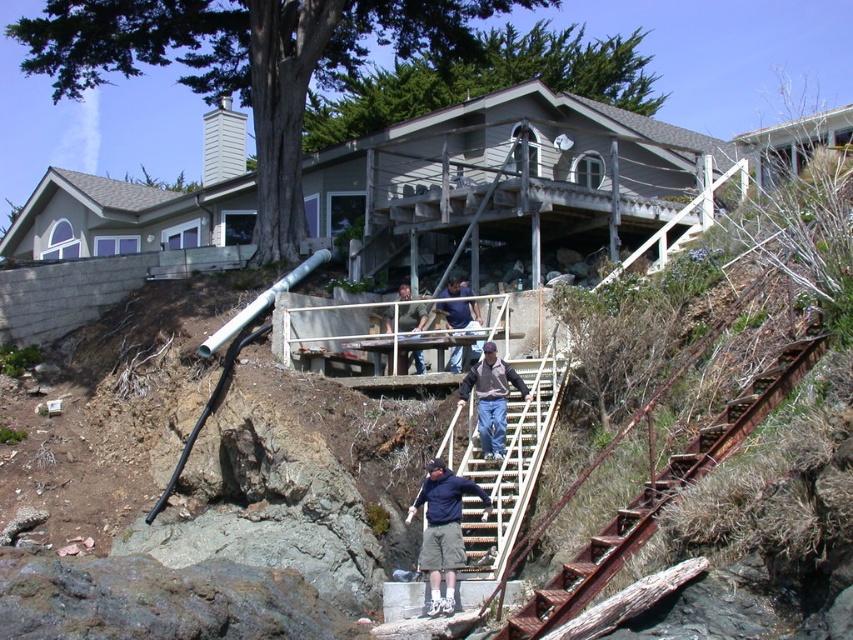
Between metallic silver stairs at center and dark blue shirt at center, which one appears on the left side from the viewer's perspective?

dark blue shirt at center is more to the left.

Which is in front, point (460, 472) or point (473, 314)?

Point (460, 472) is in front.

Find the location of `metallic silver stairs at center`. metallic silver stairs at center is located at coordinates (509, 467).

Can you confirm if rusty metal stairs at lower right is taller than metallic silver stairs at center?

Indeed, rusty metal stairs at lower right has a greater height compared to metallic silver stairs at center.

Locate an element on the screen. This screenshot has height=640, width=853. rusty metal stairs at lower right is located at coordinates (659, 497).

How much distance is there between rusty metal stairs at lower right and dark blue jacket at center?

11.39 meters

Can you confirm if rusty metal stairs at lower right is shorter than dark blue jacket at center?

Incorrect, rusty metal stairs at lower right's height does not fall short of dark blue jacket at center's.

Does point (621, 545) come in front of point (447, 512)?

Yes.

You are a GUI agent. You are given a task and a screenshot of the screen. Output one action in this format:
    pyautogui.click(x=<x>, y=<y>)
    Task: Click on the rusty metal stairs at lower right
    The image size is (853, 640).
    Given the screenshot: What is the action you would take?
    pyautogui.click(x=659, y=497)